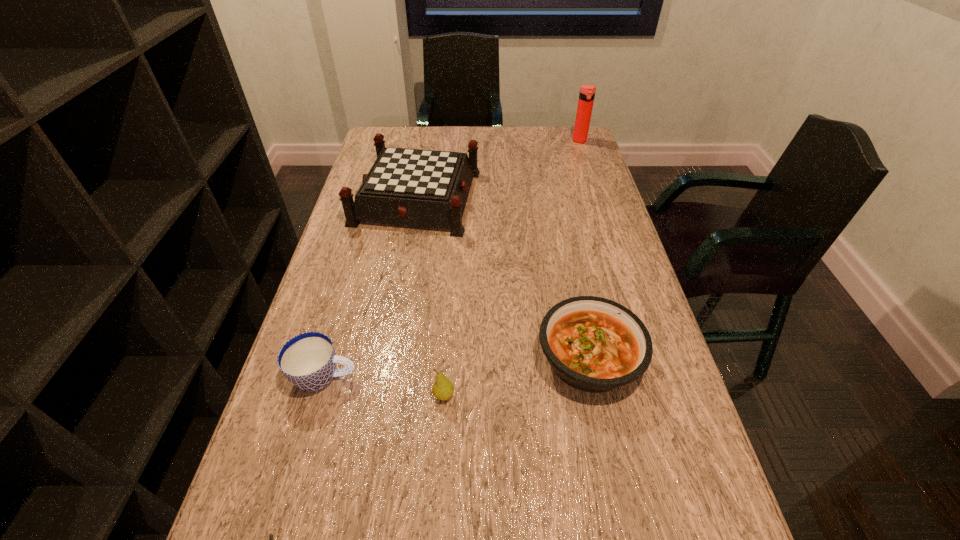
The image size is (960, 540). I want to click on vacant point located 0.320m on the side of the cup with the handle, so click(512, 377).

Find the location of `free space located on the left of the stew`. free space located on the left of the stew is located at coordinates (434, 359).

Identify the location of object that is at the far edge. (587, 92).

The image size is (960, 540). What are the coordinates of `checkerboard that is at the left edge` in the screenshot? It's located at (425, 188).

This screenshot has height=540, width=960. I want to click on cup situated at the left edge, so click(x=308, y=360).

Find the location of a particular element. This screenshot has height=540, width=960. thermos bottle that is at the right edge is located at coordinates (587, 92).

Image resolution: width=960 pixels, height=540 pixels. I want to click on stew that is positioned at the right edge, so click(x=593, y=344).

Locate an element on the screen. This screenshot has width=960, height=540. object that is at the far right corner is located at coordinates (587, 92).

At what (x,y) coordinates should I click in order to perform the action: click on free spot at the far edge of the desktop. Please return your answer as a coordinate pair (x, y). Looking at the image, I should click on (425, 141).

You are a GUI agent. You are given a task and a screenshot of the screen. Output one action in this format:
    pyautogui.click(x=<x>, y=<y>)
    Task: Click on the free region at the left edge
    
    Given the screenshot: What is the action you would take?
    pyautogui.click(x=350, y=240)